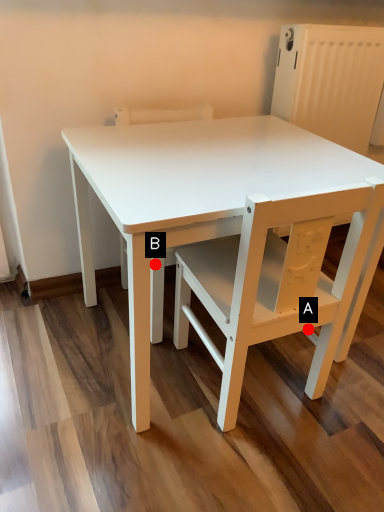
Question: Two points are circled on the image, labeled by A and B beside each circle. Which point appears farthest from the camera in this image?

Choices:
 (A) A is further
 (B) B is further

Answer: (B)